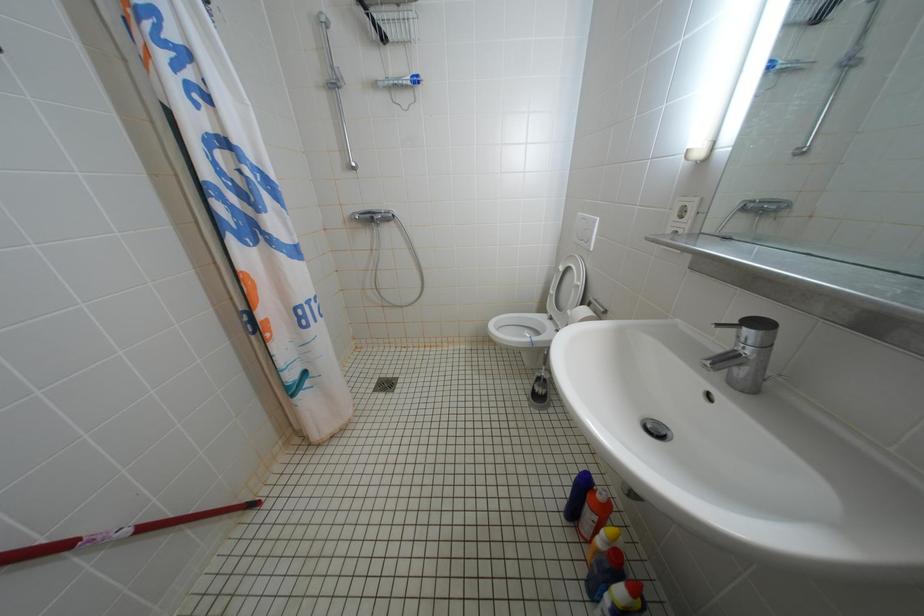
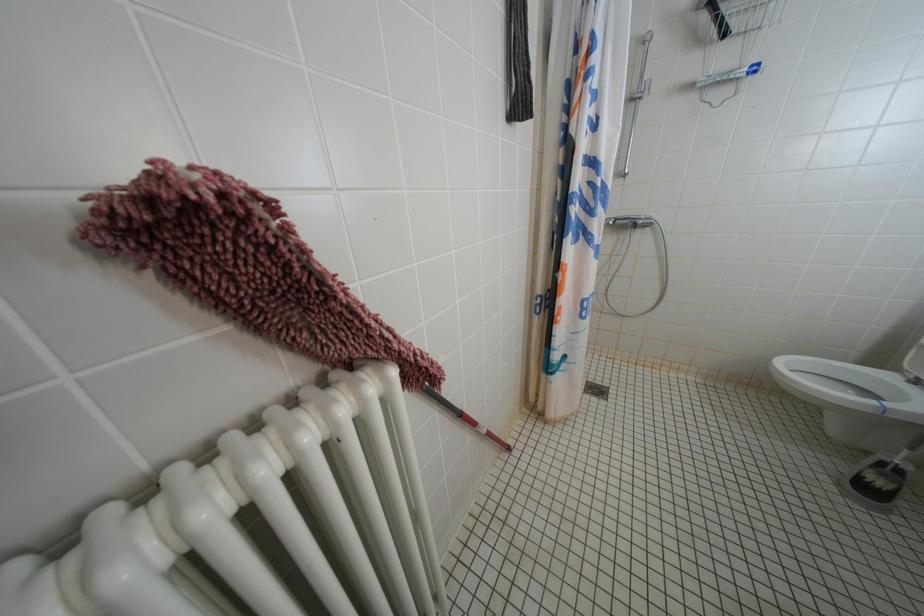
Question: The camera is either moving clockwise (left) or counter-clockwise (right) around the object. The first image is from the beginning of the video and the second image is from the end. Is the camera moving left or right when shooting the video?

Choices:
 (A) Left
 (B) Right

Answer: (B)